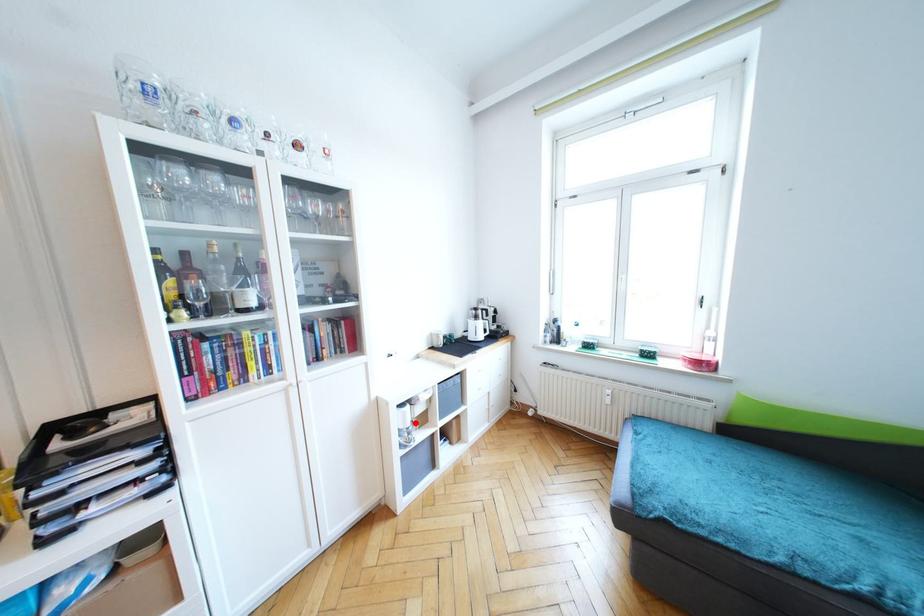
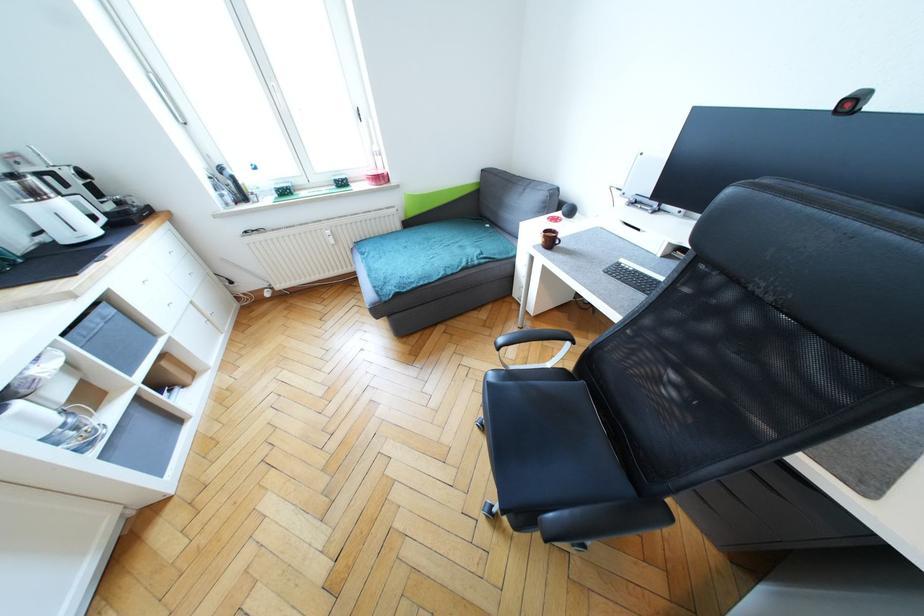
Locate, in the second image, the point that corresponds to the highlighted location in the first image.

(67, 413)